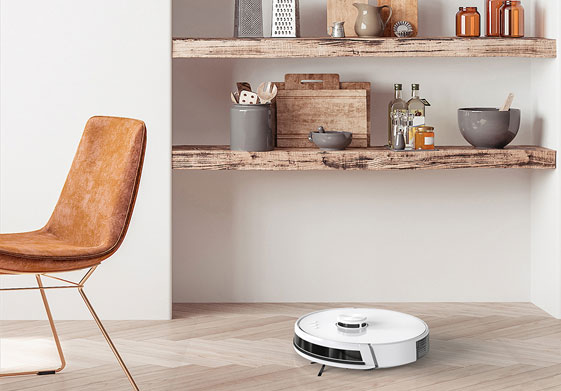
Identify the location of bowl. (333, 142).